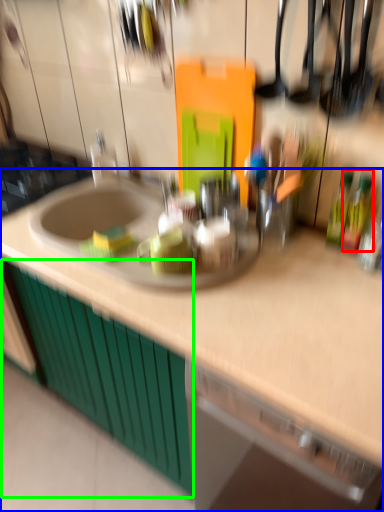
Question: Which object is positioned closest to bottle (highlighted by a red box)? Select from countertop (highlighted by a blue box) and cabinetry (highlighted by a green box).

Choices:
 (A) countertop
 (B) cabinetry

Answer: (A)